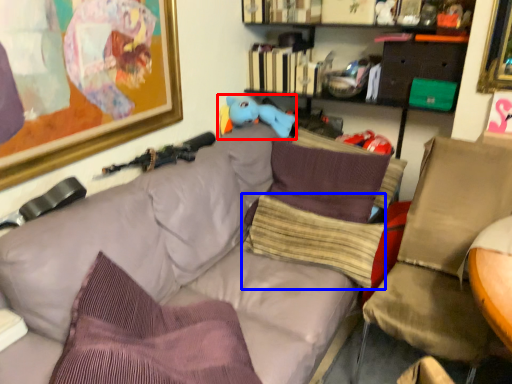
Question: Among these objects, which one is farthest to the camera, toy (highlighted by a red box) or pillow (highlighted by a blue box)?

Choices:
 (A) toy
 (B) pillow

Answer: (A)